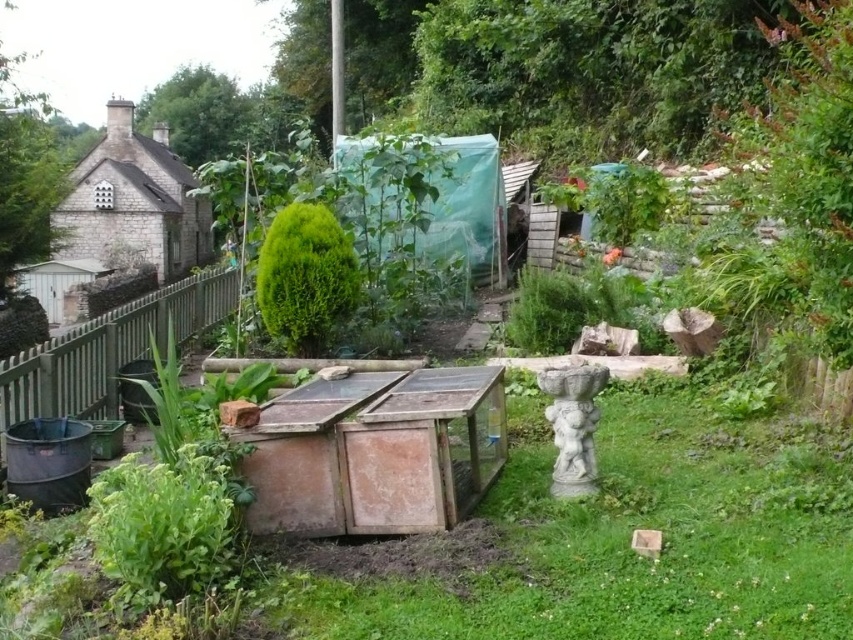
Question: Is green wooden fence at lower left above green leafy bush at center?

Choices:
 (A) no
 (B) yes

Answer: (A)

Question: Which point is farther to the camera?

Choices:
 (A) green leafy bush at center
 (B) green wooden fence at lower left

Answer: (B)

Question: Is the position of green wooden fence at lower left more distant than that of green leafy bush at center?

Choices:
 (A) no
 (B) yes

Answer: (B)

Question: Does green wooden fence at lower left appear under green leafy bush at center?

Choices:
 (A) yes
 (B) no

Answer: (A)

Question: Which of the following is the closest to the observer?

Choices:
 (A) green leafy bush at center
 (B) green wooden fence at lower left

Answer: (A)